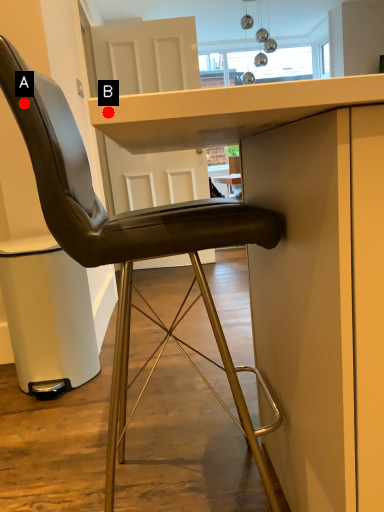
Question: Two points are circled on the image, labeled by A and B beside each circle. Which point is closer to the camera?

Choices:
 (A) A is closer
 (B) B is closer

Answer: (B)